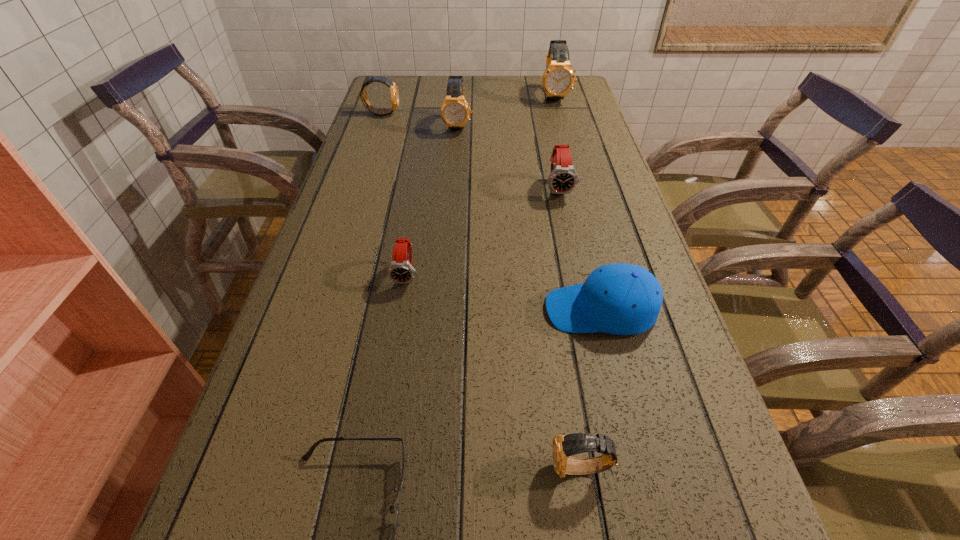
The image size is (960, 540). Identify the location of the tallest object. (558, 79).

The height and width of the screenshot is (540, 960). In order to click on the farthest gold watch in this screenshot , I will do `click(558, 79)`.

Where is `the seventh shortest object`? the seventh shortest object is located at coordinates (455, 112).

You are a GUI agent. You are given a task and a screenshot of the screen. Output one action in this format:
    pyautogui.click(x=<x>, y=<y>)
    Task: Click on the second gold watch from left to right
    
    Given the screenshot: What is the action you would take?
    pyautogui.click(x=455, y=112)

Locate an element on the screen. The width and height of the screenshot is (960, 540). the leftmost gold watch is located at coordinates (394, 92).

Image resolution: width=960 pixels, height=540 pixels. I want to click on the third biggest gold watch, so click(394, 92).

Identify the location of the third nearest watch. The height and width of the screenshot is (540, 960). (563, 178).

Image resolution: width=960 pixels, height=540 pixels. I want to click on the farther red watch, so pos(563,178).

You are a GUI agent. You are given a task and a screenshot of the screen. Output one action in this format:
    pyautogui.click(x=<x>, y=<y>)
    Task: Click on the cap
    Image resolution: width=960 pixels, height=540 pixels.
    Given the screenshot: What is the action you would take?
    pyautogui.click(x=622, y=299)

Identify the location of the second gold watch from right to left. This screenshot has width=960, height=540. (563, 447).